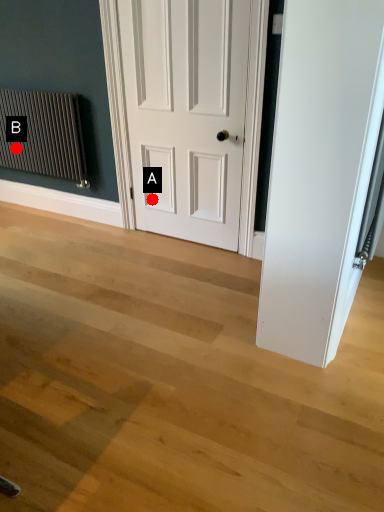
Question: Two points are circled on the image, labeled by A and B beside each circle. Which point is further to the camera?

Choices:
 (A) A is further
 (B) B is further

Answer: (B)